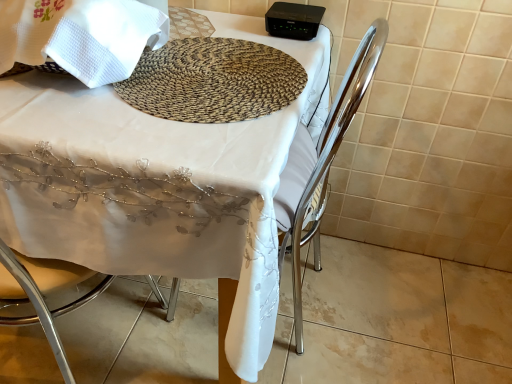
Question: Is woven natural fiber mat at center shorter than white fabric table at center?

Choices:
 (A) no
 (B) yes

Answer: (B)

Question: Can you confirm if woven natural fiber mat at center is positioned to the left of white fabric table at center?

Choices:
 (A) yes
 (B) no

Answer: (B)

Question: Would you say woven natural fiber mat at center is outside white fabric table at center?

Choices:
 (A) yes
 (B) no

Answer: (B)

Question: Is woven natural fiber mat at center positioned before white fabric table at center?

Choices:
 (A) no
 (B) yes

Answer: (A)

Question: From a real-world perspective, is woven natural fiber mat at center on white fabric table at center?

Choices:
 (A) no
 (B) yes

Answer: (B)

Question: Can you confirm if woven natural fiber mat at center is taller than white fabric table at center?

Choices:
 (A) no
 (B) yes

Answer: (A)

Question: Is white fabric table at center in front of metallic silver chair at center?

Choices:
 (A) yes
 (B) no

Answer: (B)

Question: Can you confirm if white fabric table at center is taller than metallic silver chair at center?

Choices:
 (A) no
 (B) yes

Answer: (A)

Question: Is white fabric table at center positioned behind metallic silver chair at center?

Choices:
 (A) no
 (B) yes

Answer: (B)

Question: Does white fabric table at center have a lesser width compared to metallic silver chair at center?

Choices:
 (A) yes
 (B) no

Answer: (B)

Question: Does white fabric table at center appear on the left side of metallic silver chair at center?

Choices:
 (A) yes
 (B) no

Answer: (A)

Question: From the image's perspective, is white fabric table at center under metallic silver chair at center?

Choices:
 (A) yes
 (B) no

Answer: (A)

Question: Considering the relative sizes of metallic silver chair at center and white fabric table at center in the image provided, is metallic silver chair at center smaller than white fabric table at center?

Choices:
 (A) yes
 (B) no

Answer: (A)